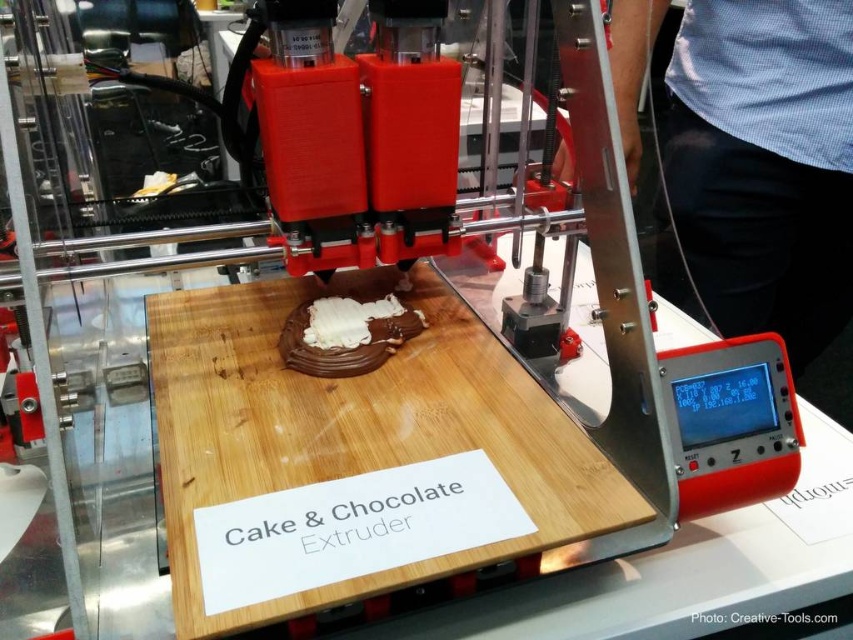
You are a baker trying to determine which of the two substances on the wooden platform is wider. The substances are the chocolate matte at center and the white glossy frosting at center. Based on their positions, which one is wider?

The chocolate matte at center is wider than the white glossy frosting at center according to the description.